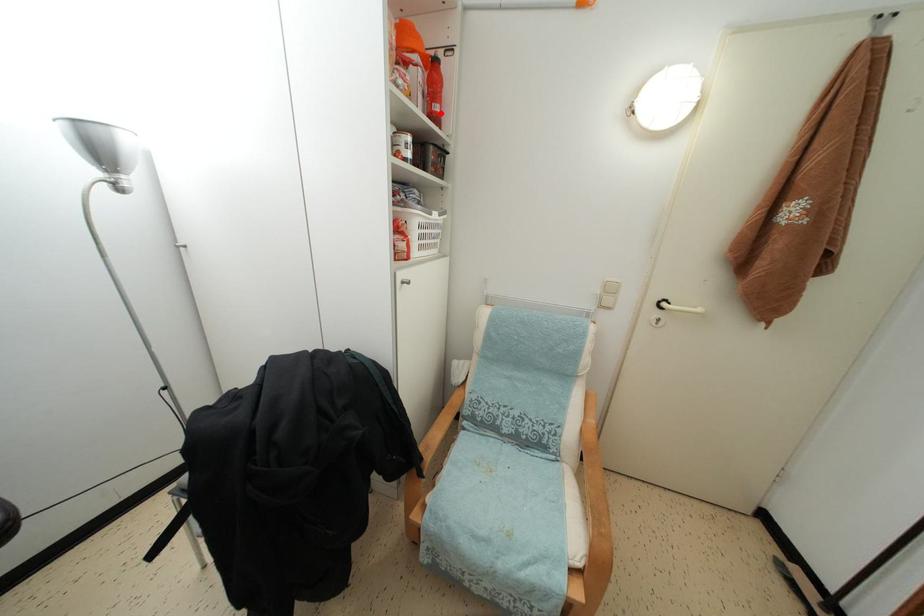
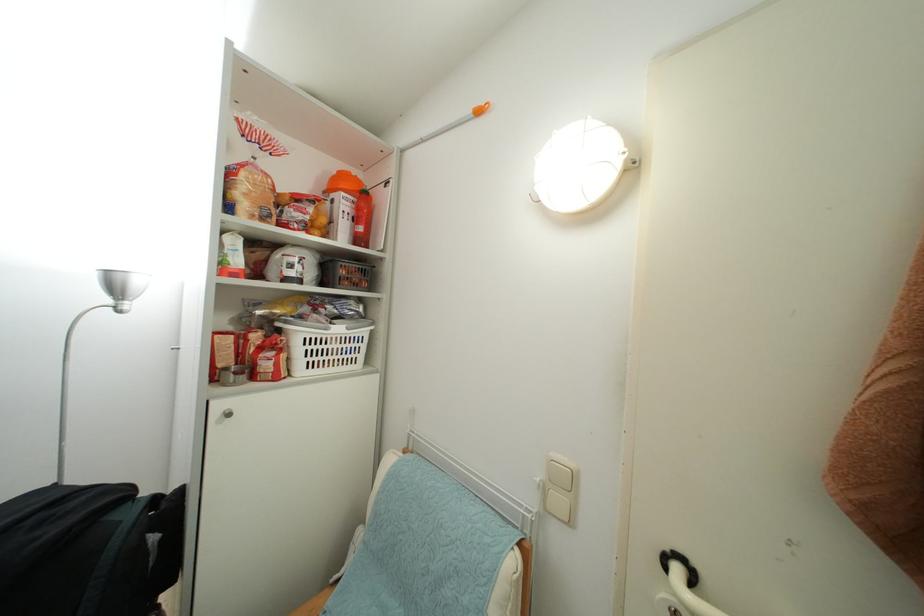
Where in the second image is the point corresponding to the highlighted location from the first image?

(365, 235)